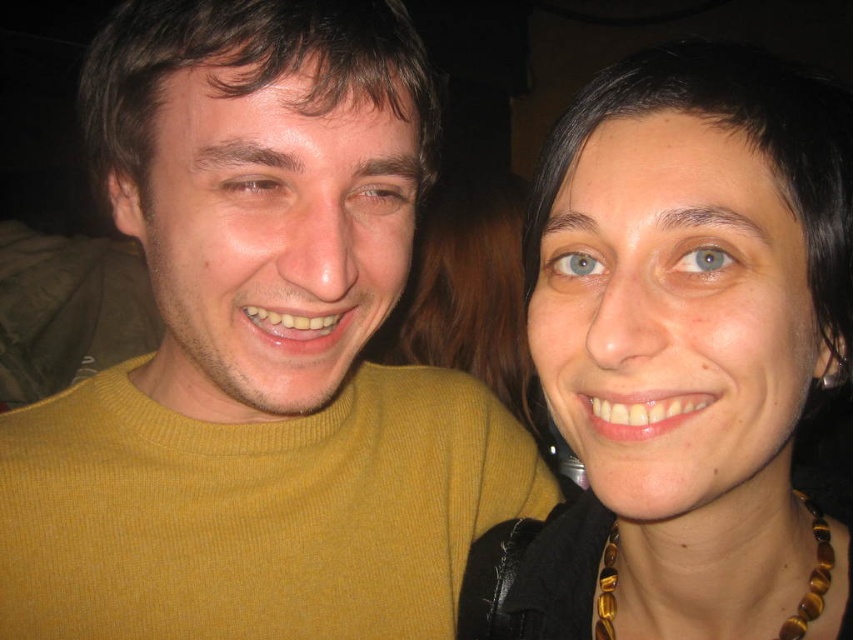
From the picture: You are a photographer trying to adjust the focus of your camera. You need to ensure that both the yellow ribbed sweater at left and the brown matte eye at upper center are in focus. Given the depth of field, what is the minimum distance the camera should be focused on to ensure both are sharp?

The camera should be focused at a point between the yellow ribbed sweater at left and the brown matte eye at upper center, approximately 4.3 inches from each, to ensure both are within the depth of field and in focus.

You are a photographer trying to frame a portrait of two people. You notice the brown matte eye at upper left and the blue matte eye at upper center in your viewfinder. Given that the minimum focus distance for your camera lens is 6 inches, will you need to adjust the focus to ensure both eyes are in sharp focus?

The distance between the brown matte eye at upper left and blue matte eye at upper center is 5.92 inches, which is less than the 6 inch minimum focus distance. Therefore, the camera will not be able to keep both eyes in focus simultaneously, so you should adjust the focus to prioritize one eye.

You are a photographer trying to adjust the lighting for a portrait. The subject is wearing a yellow ribbed sweater at left. Where should you position the light source to ensure the sweater is well lit?

The yellow ribbed sweater at left is located at point (257, 355). To ensure it is well lit, position the light source opposite to this coordinate, around point (595, 284), to create even illumination.